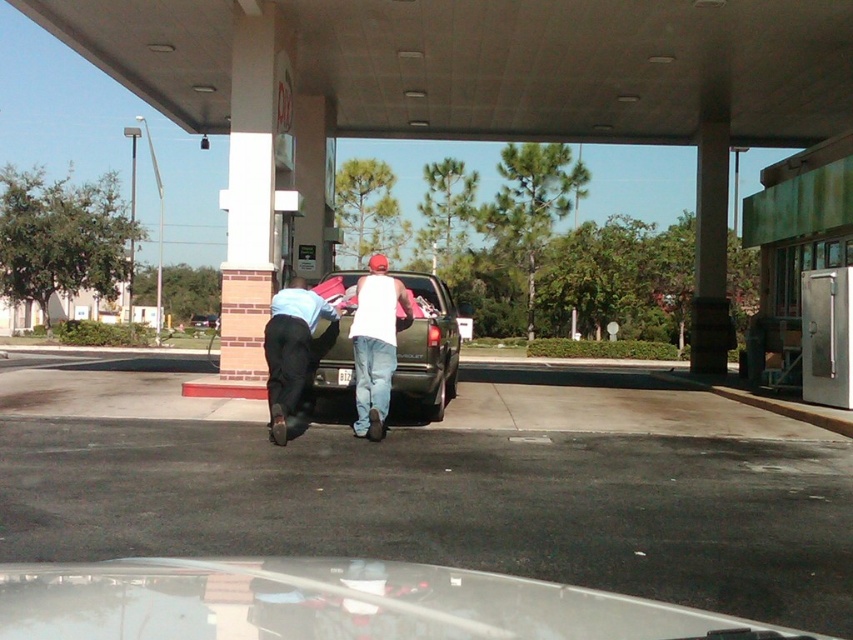
You are driving a car and need to park it between the two points marked as point (x=622, y=624). Can your car fit there if it is 4 meters long?

The distance between the two points marked as point (x=622, y=624) is 3.25 meters, which is shorter than the car length of 4 meters. Therefore, the car cannot fit between them.

You are a delivery driver who needs to park your van next to the metallic green pickup truck at center and the metallic green truck at center. Which one should you park closer to if you want to ensure there is enough space between your van and the other vehicles?

You should park closer to the metallic green truck at center because the metallic green pickup truck at center is wider, so keeping more distance from it would ensure sufficient space between your van and the wider vehicle.